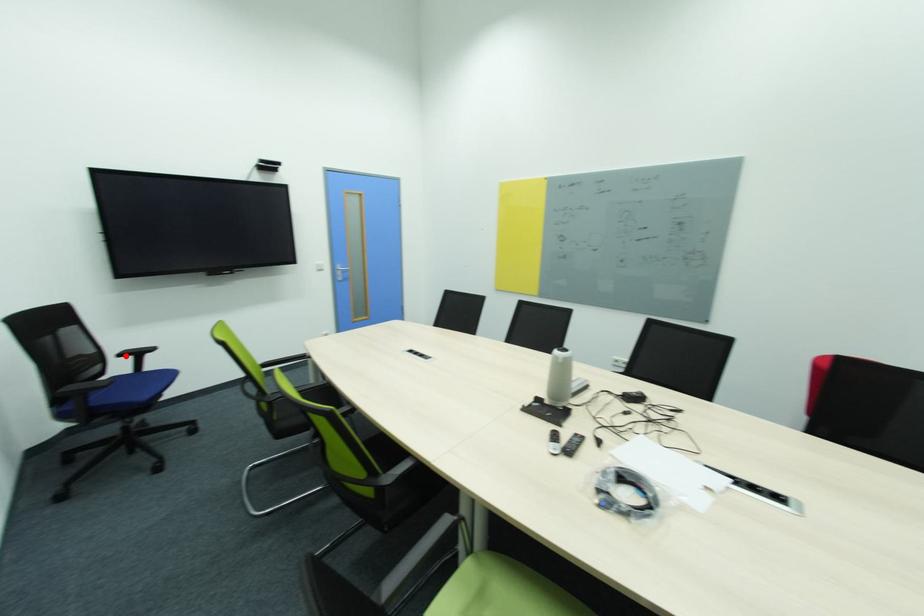
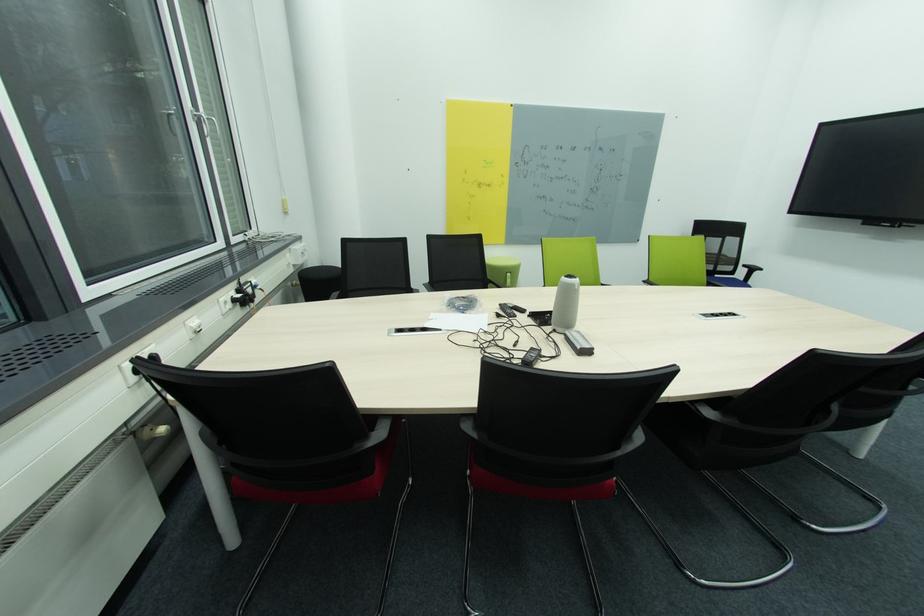
Locate, in the second image, the point that corresponds to the highlighted location in the first image.

(749, 267)